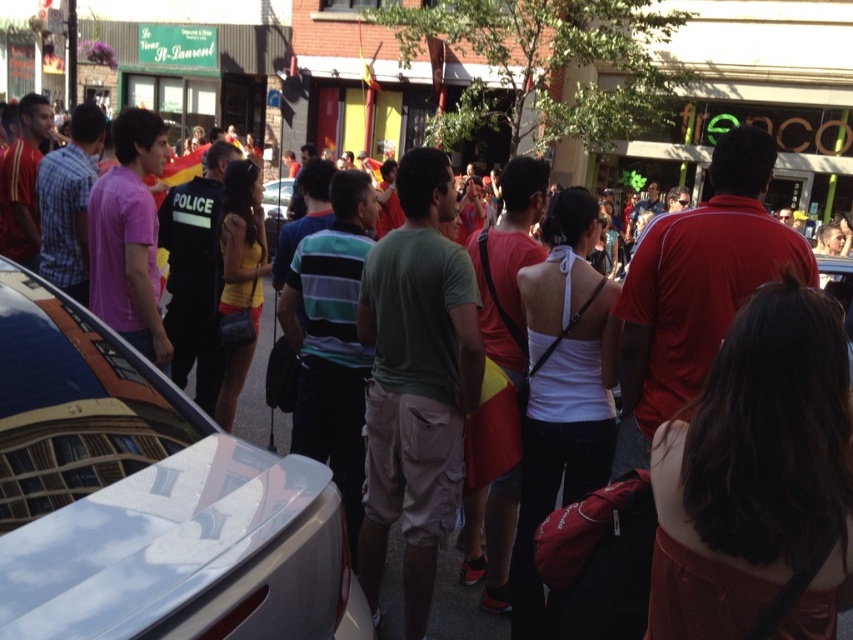
You are standing at the point marked by the coordinates point (x=148, y=499). Looking around, you see a shiny silver car at center left. Which direction should you face to see the shiny silver car at center left?

You should face towards the center left direction to see the shiny silver car at center left, as the point (x=148, y=499) is where the shiny silver car at center left is located.